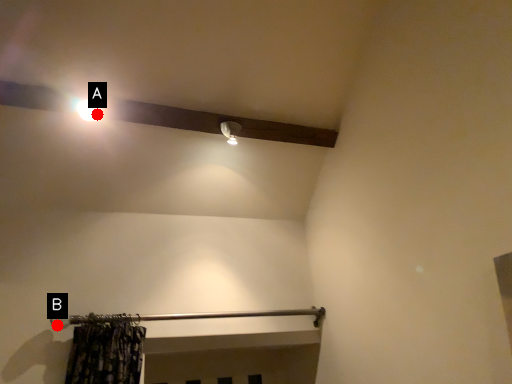
Question: Two points are circled on the image, labeled by A and B beside each circle. Among these points, which one is nearest to the camera?

Choices:
 (A) A is closer
 (B) B is closer

Answer: (B)